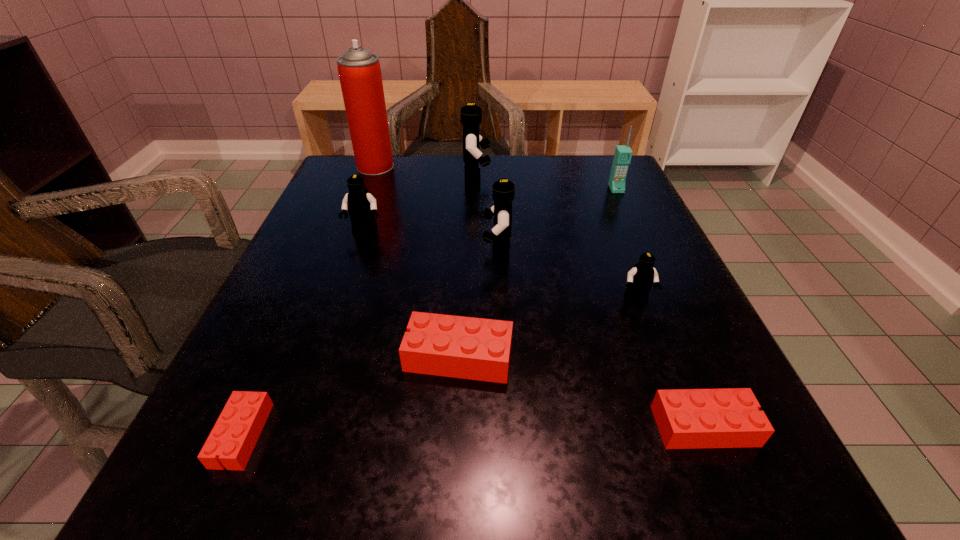
Image resolution: width=960 pixels, height=540 pixels. What are the coordinates of `red aerosol can` in the screenshot? It's located at (359, 71).

The image size is (960, 540). Find the location of `aerosol can`. aerosol can is located at coordinates (359, 71).

Locate an element on the screen. This screenshot has width=960, height=540. the farthest black Lego is located at coordinates (471, 115).

At what (x,y) coordinates should I click in order to perform the action: click on the biggest black Lego. Please return your answer as a coordinate pair (x, y). Looking at the image, I should click on (471, 115).

You are a GUI agent. You are given a task and a screenshot of the screen. Output one action in this format:
    pyautogui.click(x=<x>, y=<y>)
    Task: Click on the second biggest black Lego
    
    Given the screenshot: What is the action you would take?
    pyautogui.click(x=503, y=191)

Locate an element on the screen. Image resolution: width=960 pixels, height=540 pixels. cellular telephone is located at coordinates [622, 157].

Where is `the sixth Lego from right to left`? The image size is (960, 540). the sixth Lego from right to left is located at coordinates (361, 205).

Image resolution: width=960 pixels, height=540 pixels. Identify the location of the fifth tallest object. (361, 205).

This screenshot has width=960, height=540. What are the coordinates of `the rightmost black Lego` in the screenshot? It's located at (640, 278).

The height and width of the screenshot is (540, 960). What are the coordinates of `the sixth farthest object` in the screenshot? It's located at (640, 278).